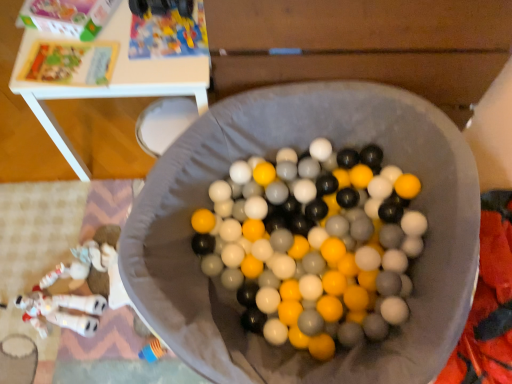
Image resolution: width=512 pixels, height=384 pixels. Describe the element at coordinates (106, 78) in the screenshot. I see `white plastic table at upper center` at that location.

At what (x,y) coordinates should I click in order to perform the action: click on white plastic table at upper center. Please return your answer as a coordinate pair (x, y). The width and height of the screenshot is (512, 384). Looking at the image, I should click on (106, 78).

The image size is (512, 384). I want to click on white plastic table at upper center, so point(106,78).